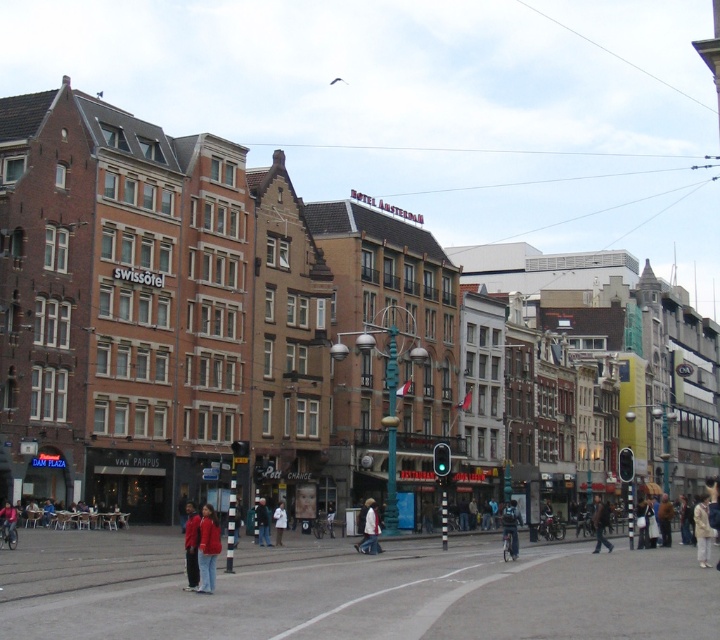
You are standing at the center of the street in the image and want to find the dark blue jeans at lower center. According to the coordinates provided, in which direction should you move relative to your current position?

The dark blue jeans at lower center is located at coordinates point (510, 529), which is to the right and slightly forward from the center. You should move to the right and slightly forward to reach it.

You are standing at the point marked as point [510,529] in the image. Looking around, you see dark blue jeans at lower center. What is the color of the clothing item you are standing on?

The point [510,529] is on dark blue jeans at lower center, so the clothing item you are standing on is dark blue in color.

You are a pedestrian standing at the traffic light that is green. You see a person wearing a red fabric jacket at lower left and another wearing a dark blue jacket at center. Which jacket is closer to the left side of the street?

The red fabric jacket at lower left is closer to the left side of the street because it is positioned to the left of the dark blue jacket at center.